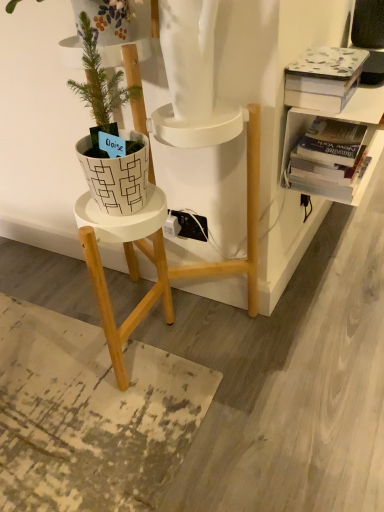
Question: From the image's perspective, is white textured book at upper right, the 2th book from the bottom, located above or below white matte pot at left?

Choices:
 (A) above
 (B) below

Answer: (A)

Question: Considering their positions, is white textured book at upper right, the 2th book from the bottom, located in front of or behind white matte pot at left?

Choices:
 (A) behind
 (B) front

Answer: (A)

Question: Based on their relative distances, which object is farther from the white textured book at upper right, the first book when ordered from top to bottom?

Choices:
 (A) hardcover book at upper right, placed as the second book when sorted from top to bottom
 (B) white matte pot at left

Answer: (B)

Question: Estimate the real-world distances between objects in this image. Which object is farther from the white matte pot at left?

Choices:
 (A) white textured book at upper right, the first book when ordered from top to bottom
 (B) hardcover book at upper right, placed as the first book when sorted from bottom to top

Answer: (B)